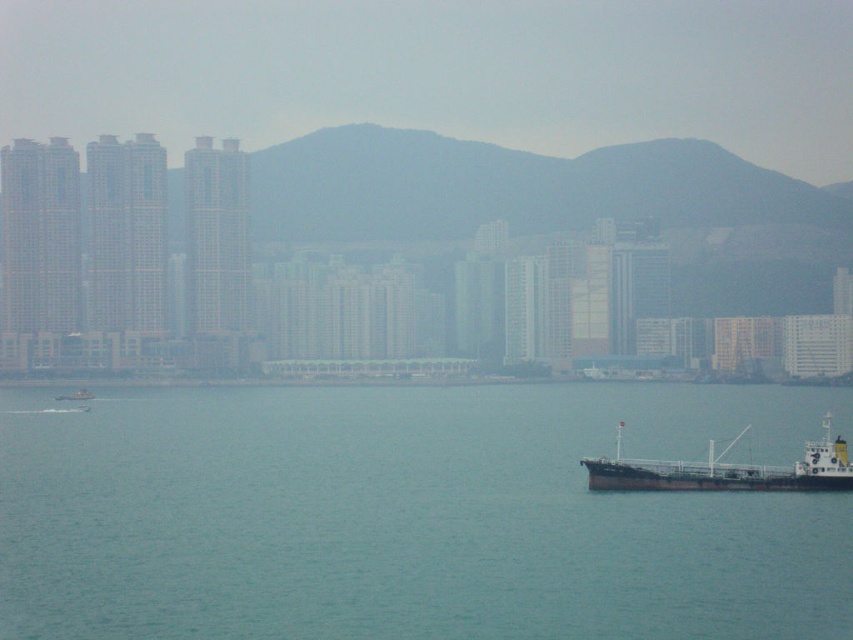
You are a photographer trying to capture the waterfront scene. You want to ensure that both the clear blue water at center and the brown matte cargo ship at lower right are visible in your shot. Given their sizes, which object should you frame first to ensure it fits in the composition?

The clear blue water at center is bigger than the brown matte cargo ship at lower right, so you should frame the clear blue water at center first to accommodate its larger size in the composition.

You are a tour guide explaining the harbor to visitors. You mention both the brown matte cargo ship at lower right and the metallic gray boat at lower left. Which one is bigger?

The brown matte cargo ship at lower right is larger in size compared to the metallic gray boat at lower left.

You are a photographer trying to capture the waterfront scene. You want to ensure that the clear blue water at center and the metallic gray boat at lower left are both visible in your shot. Based on their heights, which object should you position closer to the foreground to ensure both are in focus?

The clear blue water at center has a greater height compared to the metallic gray boat at lower left. To ensure both are in focus, position the metallic gray boat at lower left closer to the foreground since it is shorter, allowing the taller clear blue water at center to still be within the depth of field.